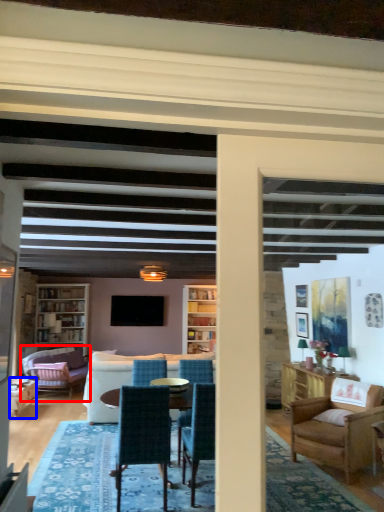
Question: Which object is closer to the camera taking this photo, studio couch (highlighted by a red box) or chair (highlighted by a blue box)?

Choices:
 (A) studio couch
 (B) chair

Answer: (B)